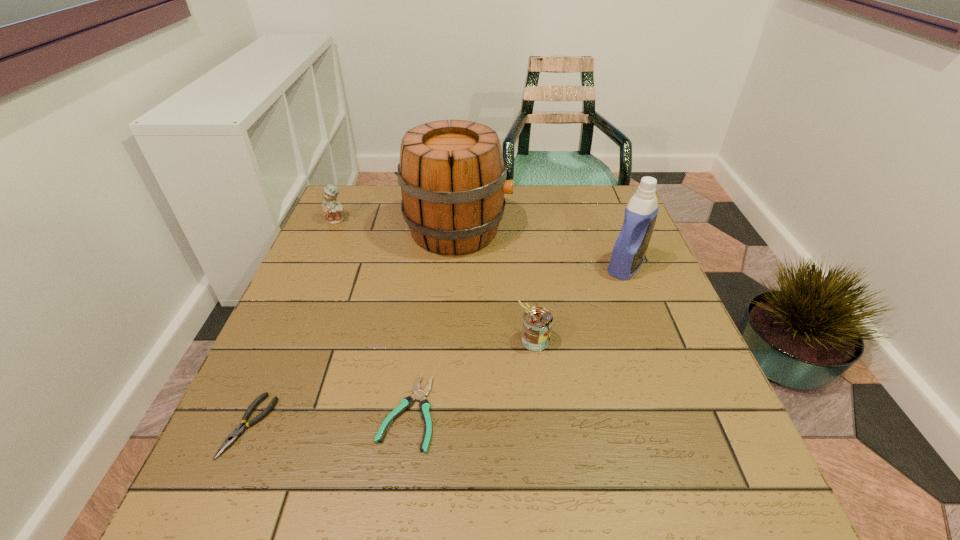
Where is `blank space that satisfies the following two spatial constraints: 1. on the front-facing side of the taller pliers; 2. on the left side of the teddy bear`? blank space that satisfies the following two spatial constraints: 1. on the front-facing side of the taller pliers; 2. on the left side of the teddy bear is located at coordinates (247, 426).

Locate an element on the screen. free space that satisfies the following two spatial constraints: 1. on the front-facing side of the teddy bear; 2. on the right side of the detergent is located at coordinates (317, 266).

Identify the location of vacant space that satisfies the following two spatial constraints: 1. on the front-facing side of the teddy bear; 2. on the right side of the shortest object. This screenshot has width=960, height=540. (252, 413).

Locate an element on the screen. The height and width of the screenshot is (540, 960). vacant space that satisfies the following two spatial constraints: 1. on the front-facing side of the teddy bear; 2. on the left side of the can is located at coordinates (284, 340).

Image resolution: width=960 pixels, height=540 pixels. Identify the location of free space that satisfies the following two spatial constraints: 1. on the side of the cider where the spigot is located; 2. on the back side of the detergent. coord(455,266).

The width and height of the screenshot is (960, 540). In order to click on free space in the image that satisfies the following two spatial constraints: 1. on the back side of the rightmost object; 2. on the side of the cider where the spigot is located in this screenshot , I will do `click(612, 230)`.

What are the coordinates of `blank area in the image that satisfies the following two spatial constraints: 1. on the front-facing side of the rightmost object; 2. on the left side of the teddy bear` in the screenshot? It's located at (317, 266).

The height and width of the screenshot is (540, 960). I want to click on free space that satisfies the following two spatial constraints: 1. on the back side of the third nearest object; 2. on the right side of the shortest object, so (418, 340).

The width and height of the screenshot is (960, 540). What are the coordinates of `free spot that satisfies the following two spatial constraints: 1. on the side of the cider where the spigot is located; 2. on the left side of the can` in the screenshot? It's located at (450, 340).

Locate an element on the screen. free location that satisfies the following two spatial constraints: 1. on the side of the cider where the spigot is located; 2. on the left side of the fourth farthest object is located at coordinates click(450, 340).